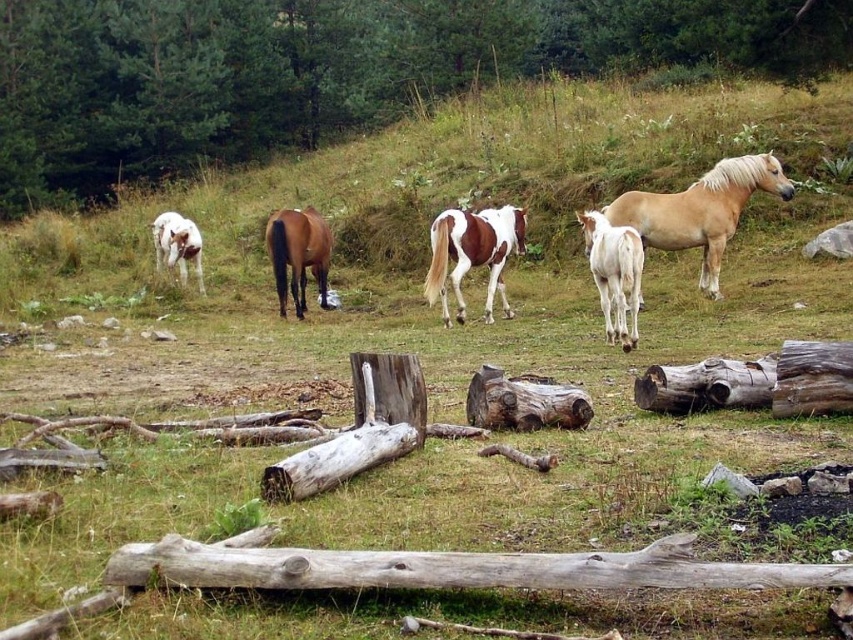
Does point (763, 154) lie in front of point (315, 264)?

Yes.

Is the position of light brown horse at right less distant than that of brown glossy horse at center?

Yes, light brown horse at right is in front of brown glossy horse at center.

This screenshot has height=640, width=853. I want to click on light brown horse at right, so click(701, 211).

Locate an element on the screen. light brown horse at right is located at coordinates (701, 211).

Describe the element at coordinates (299, 253) in the screenshot. I see `brown glossy horse at center` at that location.

Locate an element on the screen. This screenshot has height=640, width=853. brown glossy horse at center is located at coordinates (299, 253).

Can you confirm if light brown horse at right is smaller than painted wood horse at center?

Actually, light brown horse at right might be larger than painted wood horse at center.

Which is below, light brown horse at right or painted wood horse at center?

painted wood horse at center is lower down.

I want to click on light brown horse at right, so click(701, 211).

You are a GUI agent. You are given a task and a screenshot of the screen. Output one action in this format:
    pyautogui.click(x=<x>, y=<y>)
    Task: Click on the light brown horse at right
    This screenshot has width=853, height=640.
    Given the screenshot: What is the action you would take?
    pyautogui.click(x=701, y=211)